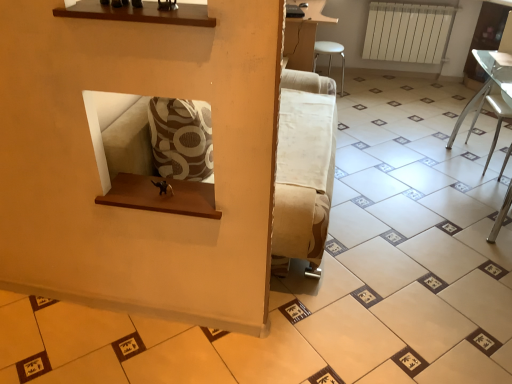
The width and height of the screenshot is (512, 384). Find the location of `clear glass table at right, which appears as the 1th furniture when ordered from the bottom`. clear glass table at right, which appears as the 1th furniture when ordered from the bottom is located at coordinates (490, 92).

At what (x,y) coordinates should I click in order to perform the action: click on white fabric armchair at lower right. Please return your answer as a coordinate pair (x, y). The width and height of the screenshot is (512, 384). Looking at the image, I should click on pos(507,35).

Is white matte radiator at upper right with white plastic stool at upper right, which is the 1th furniture from top to bottom?

No.

Is white matte radiator at upper right oriented away from white plastic stool at upper right, positioned as the 2th furniture in front-to-back order?

white matte radiator at upper right is not turned away from white plastic stool at upper right, positioned as the 2th furniture in front-to-back order.

Which is in front, white matte radiator at upper right or white plastic stool at upper right, which appears as the 1th furniture when viewed from the left?

white plastic stool at upper right, which appears as the 1th furniture when viewed from the left, is in front.

From the image's perspective, is white matte radiator at upper right under clear glass table at right, which is the first furniture in front-to-back order?

Incorrect, from the image's perspective, white matte radiator at upper right is higher than clear glass table at right, which is the first furniture in front-to-back order.

From a real-world perspective, is white matte radiator at upper right under clear glass table at right, acting as the 2th furniture starting from the left?

No, from a real-world perspective, white matte radiator at upper right is not under clear glass table at right, acting as the 2th furniture starting from the left.

Is white matte radiator at upper right at the back of white plastic stool at upper right, which is the 1th furniture from top to bottom?

No, white plastic stool at upper right, which is the 1th furniture from top to bottom,'s orientation is not away from white matte radiator at upper right.

Which object is positioned more to the left, white plastic stool at upper right, which ranks as the 2th furniture in right-to-left order, or white matte radiator at upper right?

Positioned to the left is white plastic stool at upper right, which ranks as the 2th furniture in right-to-left order.

Is point (341, 88) positioned in front of point (375, 37)?

Yes, point (341, 88) is closer to viewer.

Would you say white plastic stool at upper right, which ranks as the 2th furniture in right-to-left order, is inside or outside white matte radiator at upper right?

white plastic stool at upper right, which ranks as the 2th furniture in right-to-left order, is located beyond the bounds of white matte radiator at upper right.

From a real-world perspective, is clear glass table at right, which is the 1th furniture in right-to-left order, physically located above or below white matte radiator at upper right?

Clearly, from a real-world perspective, clear glass table at right, which is the 1th furniture in right-to-left order, is below white matte radiator at upper right.

How distant is clear glass table at right, which is the first furniture in front-to-back order, from white matte radiator at upper right?

They are 1.14 meters apart.

Find the location of a particular element. The width and height of the screenshot is (512, 384). radiator lying behind the clear glass table at right, acting as the 2th furniture starting from the left is located at coordinates (408, 32).

Who is smaller, clear glass table at right, placed as the 2th furniture when sorted from back to front, or white matte radiator at upper right?

Smaller between the two is white matte radiator at upper right.

Considering the relative positions of white plastic stool at upper right, which ranks as the 2th furniture in right-to-left order, and clear glass table at right, which is the first furniture in front-to-back order, in the image provided, is white plastic stool at upper right, which ranks as the 2th furniture in right-to-left order, to the left of clear glass table at right, which is the first furniture in front-to-back order, from the viewer's perspective?

Indeed, white plastic stool at upper right, which ranks as the 2th furniture in right-to-left order, is positioned on the left side of clear glass table at right, which is the first furniture in front-to-back order.

Is white plastic stool at upper right, which is the 1th furniture from top to bottom, shorter than clear glass table at right, which is the first furniture in front-to-back order?

Correct, white plastic stool at upper right, which is the 1th furniture from top to bottom, is not as tall as clear glass table at right, which is the first furniture in front-to-back order.

Is clear glass table at right, marked as the 2th furniture in a top-to-bottom arrangement, located within white plastic stool at upper right, positioned as the 2th furniture in front-to-back order?

Definitely not — clear glass table at right, marked as the 2th furniture in a top-to-bottom arrangement, is not inside white plastic stool at upper right, positioned as the 2th furniture in front-to-back order.

Between point (332, 47) and point (485, 64), which one is positioned in front?

The point (485, 64) is in front.

From a real-world perspective, is white fabric armchair at lower right positioned under white matte radiator at upper right based on gravity?

Incorrect, from a real-world perspective, white fabric armchair at lower right is higher than white matte radiator at upper right.

Is point (480, 108) behind point (439, 13)?

No, it is not.

Is white fabric armchair at lower right to the left of white matte radiator at upper right from the viewer's perspective?

In fact, white fabric armchair at lower right is to the right of white matte radiator at upper right.

Is white fabric armchair at lower right taller than white matte radiator at upper right?

Correct, white fabric armchair at lower right is much taller as white matte radiator at upper right.

Is clear glass table at right, acting as the 2th furniture starting from the left, closer to camera compared to white fabric armchair at lower right?

Yes, clear glass table at right, acting as the 2th furniture starting from the left, is closer to the camera.

Could you tell me if clear glass table at right, which is the 1th furniture in right-to-left order, is facing white fabric armchair at lower right?

No, clear glass table at right, which is the 1th furniture in right-to-left order, is not turned towards white fabric armchair at lower right.

Is clear glass table at right, marked as the 2th furniture in a top-to-bottom arrangement, wider or thinner than white fabric armchair at lower right?

Considering their sizes, clear glass table at right, marked as the 2th furniture in a top-to-bottom arrangement, looks slimmer than white fabric armchair at lower right.

Find the location of a particular element. This screenshot has width=512, height=384. radiator behind the white plastic stool at upper right, positioned as the 2th furniture in front-to-back order is located at coordinates [x=408, y=32].

Locate an element on the screen. furniture that is the 1st one when counting leftward from the white matte radiator at upper right is located at coordinates (490, 92).

Which object lies nearer to the anchor point white fabric armchair at lower right, clear glass table at right, acting as the 2th furniture starting from the left, or white plastic stool at upper right, positioned as the 2th furniture in front-to-back order?

Among the two, clear glass table at right, acting as the 2th furniture starting from the left, is located nearer to white fabric armchair at lower right.

From the image, which object appears to be farther from white fabric armchair at lower right, white matte radiator at upper right or white plastic stool at upper right, positioned as the 2th furniture in front-to-back order?

white plastic stool at upper right, positioned as the 2th furniture in front-to-back order, is positioned further to the anchor white fabric armchair at lower right.

When comparing their distances from white plastic stool at upper right, which appears as the 1th furniture when viewed from the left, does white matte radiator at upper right or white fabric armchair at lower right seem closer?

The object closer to white plastic stool at upper right, which appears as the 1th furniture when viewed from the left, is white matte radiator at upper right.

From the image, which object appears to be farther from clear glass table at right, which is the first furniture in front-to-back order, white plastic stool at upper right, which ranks as the 2th furniture in bottom-to-top order, or white fabric armchair at lower right?

white plastic stool at upper right, which ranks as the 2th furniture in bottom-to-top order, is further to clear glass table at right, which is the first furniture in front-to-back order.

Based on their spatial positions, is clear glass table at right, which appears as the 1th furniture when ordered from the bottom, or white fabric armchair at lower right further from white plastic stool at upper right, which is the 1th furniture from top to bottom?

white fabric armchair at lower right lies further to white plastic stool at upper right, which is the 1th furniture from top to bottom, than the other object.

Looking at the image, which one is located closer to white matte radiator at upper right, clear glass table at right, which appears as the 1th furniture when ordered from the bottom, or white plastic stool at upper right, positioned as the 2th furniture in front-to-back order?

The object closer to white matte radiator at upper right is white plastic stool at upper right, positioned as the 2th furniture in front-to-back order.

From the image, which object appears to be farther from white plastic stool at upper right, which ranks as the 2th furniture in right-to-left order, white fabric armchair at lower right or white matte radiator at upper right?

Among the two, white fabric armchair at lower right is located further to white plastic stool at upper right, which ranks as the 2th furniture in right-to-left order.

From the image, which object appears to be farther from clear glass table at right, which is the first furniture in front-to-back order, white plastic stool at upper right, which ranks as the 2th furniture in right-to-left order, or white matte radiator at upper right?

Based on the image, white plastic stool at upper right, which ranks as the 2th furniture in right-to-left order, appears to be further to clear glass table at right, which is the first furniture in front-to-back order.

This screenshot has height=384, width=512. Find the location of `furniture between white fabric armchair at lower right and white matte radiator at upper right from front to back`. furniture between white fabric armchair at lower right and white matte radiator at upper right from front to back is located at coordinates (330, 56).

In order to click on armchair between clear glass table at right, which is the first furniture in front-to-back order, and white plastic stool at upper right, which ranks as the 2th furniture in right-to-left order, from front to back in this screenshot , I will do `click(507, 35)`.

Find the location of a particular element. furniture between clear glass table at right, which is the first furniture in front-to-back order, and white matte radiator at upper right in the front-back direction is located at coordinates (330, 56).

Identify the location of armchair located between clear glass table at right, which is the first furniture in front-to-back order, and white matte radiator at upper right in the depth direction. The height and width of the screenshot is (384, 512). (507, 35).